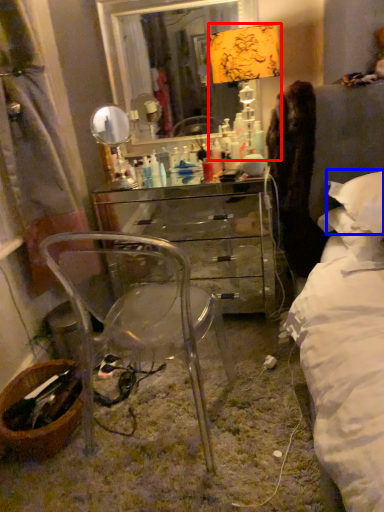
Question: Among these objects, which one is nearest to the camera, table lamp (highlighted by a red box) or pillow (highlighted by a blue box)?

Choices:
 (A) table lamp
 (B) pillow

Answer: (B)